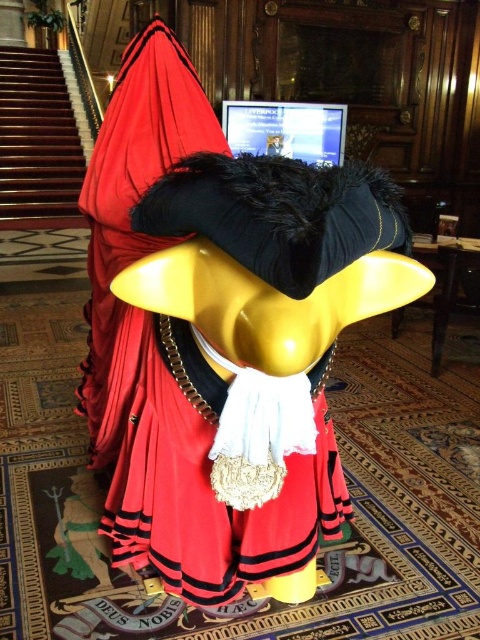
Question: Which of the following is the farthest from the observer?

Choices:
 (A) wooden staircase at left
 (B) shiny black laptop at upper center

Answer: (A)

Question: Does wooden staircase at left appear under shiny black laptop at upper center?

Choices:
 (A) yes
 (B) no

Answer: (B)

Question: Which of the following is the farthest from the observer?

Choices:
 (A) [x=17, y=180]
 (B) [x=340, y=147]

Answer: (A)

Question: Is wooden staircase at left below shiny black laptop at upper center?

Choices:
 (A) yes
 (B) no

Answer: (B)

Question: Is wooden staircase at left positioned in front of shiny black laptop at upper center?

Choices:
 (A) no
 (B) yes

Answer: (A)